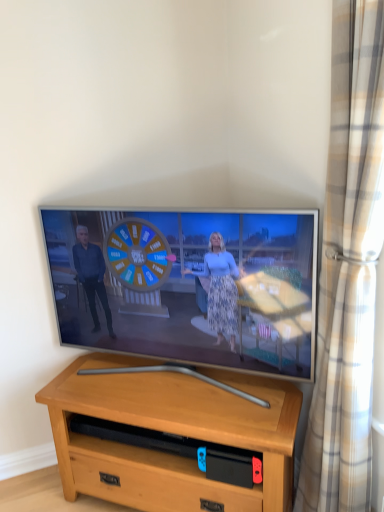
Question: Is light brown wood desk at center oriented away from beige plaid curtain at right?

Choices:
 (A) yes
 (B) no

Answer: (B)

Question: Is beige plaid curtain at right completely or partially inside light brown wood desk at center?

Choices:
 (A) no
 (B) yes

Answer: (A)

Question: Is light brown wood desk at center wider than beige plaid curtain at right?

Choices:
 (A) no
 (B) yes

Answer: (B)

Question: Can you confirm if light brown wood desk at center is taller than beige plaid curtain at right?

Choices:
 (A) no
 (B) yes

Answer: (A)

Question: From a real-world perspective, is light brown wood desk at center over beige plaid curtain at right?

Choices:
 (A) no
 (B) yes

Answer: (A)

Question: Considering their positions, is light brown wood desk at center located in front of or behind beige plaid curtain at right?

Choices:
 (A) behind
 (B) front

Answer: (A)

Question: Which is correct: light brown wood desk at center is inside beige plaid curtain at right, or outside of it?

Choices:
 (A) inside
 (B) outside

Answer: (B)

Question: From the image's perspective, is light brown wood desk at center positioned above or below beige plaid curtain at right?

Choices:
 (A) above
 (B) below

Answer: (B)

Question: Looking at their shapes, would you say light brown wood desk at center is wider or thinner than beige plaid curtain at right?

Choices:
 (A) wide
 (B) thin

Answer: (A)

Question: Which is correct: flat screen tv at center is inside beige plaid curtain at right, or outside of it?

Choices:
 (A) inside
 (B) outside

Answer: (B)

Question: From the image's perspective, is flat screen tv at center above or below beige plaid curtain at right?

Choices:
 (A) below
 (B) above

Answer: (B)

Question: In the image, is flat screen tv at center positioned in front of or behind beige plaid curtain at right?

Choices:
 (A) front
 (B) behind

Answer: (B)

Question: Considering the positions of flat screen tv at center and beige plaid curtain at right in the image, is flat screen tv at center taller or shorter than beige plaid curtain at right?

Choices:
 (A) short
 (B) tall

Answer: (A)

Question: Looking at their shapes, would you say flat screen tv at center is wider or thinner than light brown wood desk at center?

Choices:
 (A) thin
 (B) wide

Answer: (A)

Question: From the image's perspective, is flat screen tv at center positioned above or below light brown wood desk at center?

Choices:
 (A) above
 (B) below

Answer: (A)